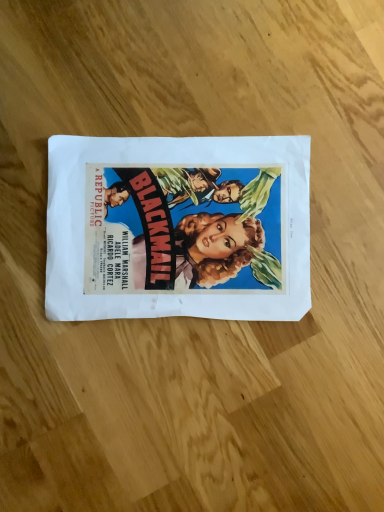
Image resolution: width=384 pixels, height=512 pixels. Find the location of `free spot above matte paper poster at center (from a real-world perspective)`. free spot above matte paper poster at center (from a real-world perspective) is located at coordinates (179, 226).